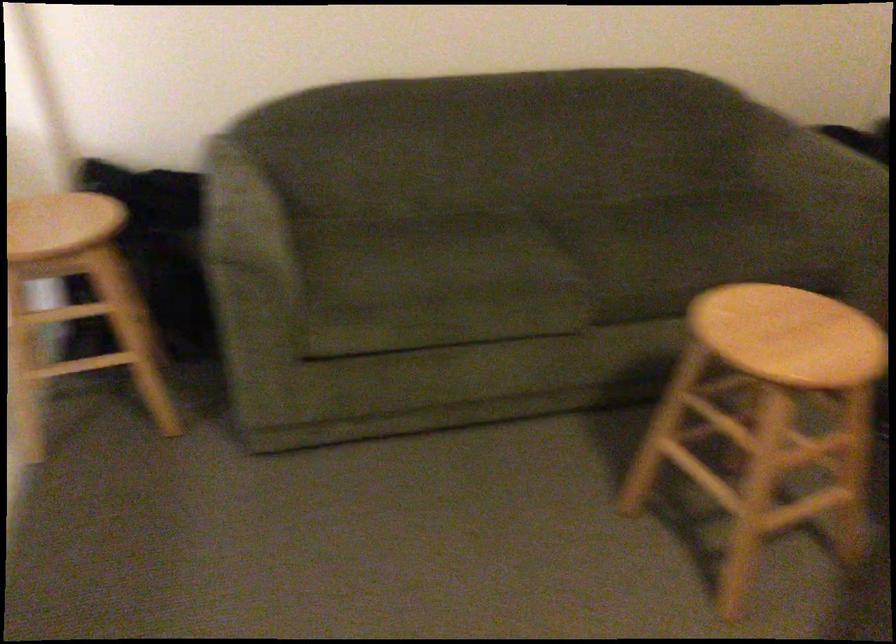
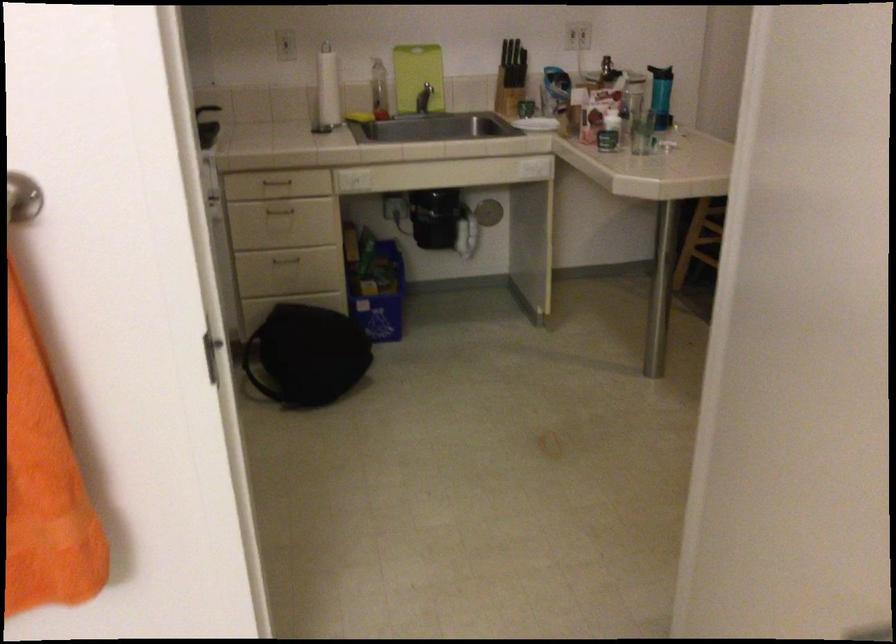
What movement of the cameraman would produce the second image?

The cameraman walked toward left, backward.